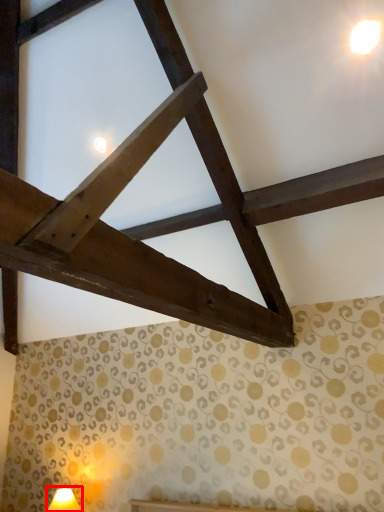
Question: Where is table lamp (annotated by the red box) located in relation to light in the image?

Choices:
 (A) left
 (B) right

Answer: (A)